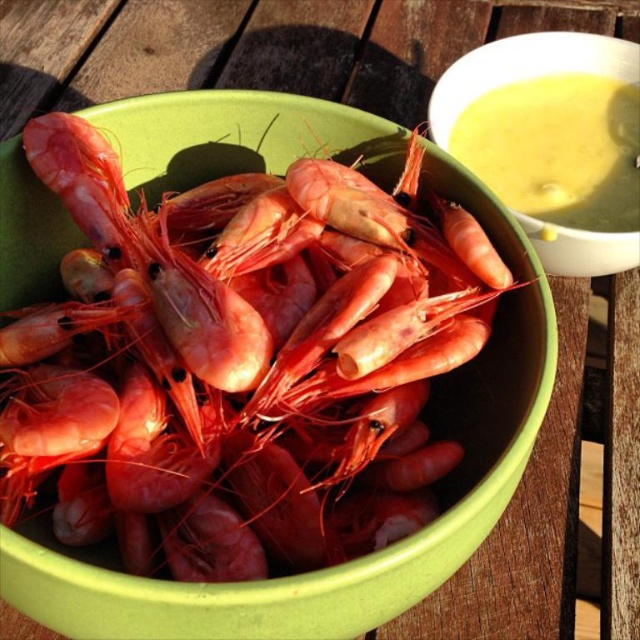
Question: Does glossy pink shrimp at center appear on the left side of yellow creamy soup at upper right?

Choices:
 (A) yes
 (B) no

Answer: (A)

Question: Does glossy pink shrimp at center appear on the left side of yellow creamy soup at upper right?

Choices:
 (A) yes
 (B) no

Answer: (A)

Question: Which point is farther to the camera?

Choices:
 (A) glossy pink shrimp at center
 (B) yellow creamy soup at upper right

Answer: (B)

Question: Which object is closer to the camera taking this photo?

Choices:
 (A) yellow creamy soup at upper right
 (B) glossy pink shrimp at center

Answer: (B)

Question: Is glossy pink shrimp at center bigger than yellow creamy soup at upper right?

Choices:
 (A) no
 (B) yes

Answer: (B)